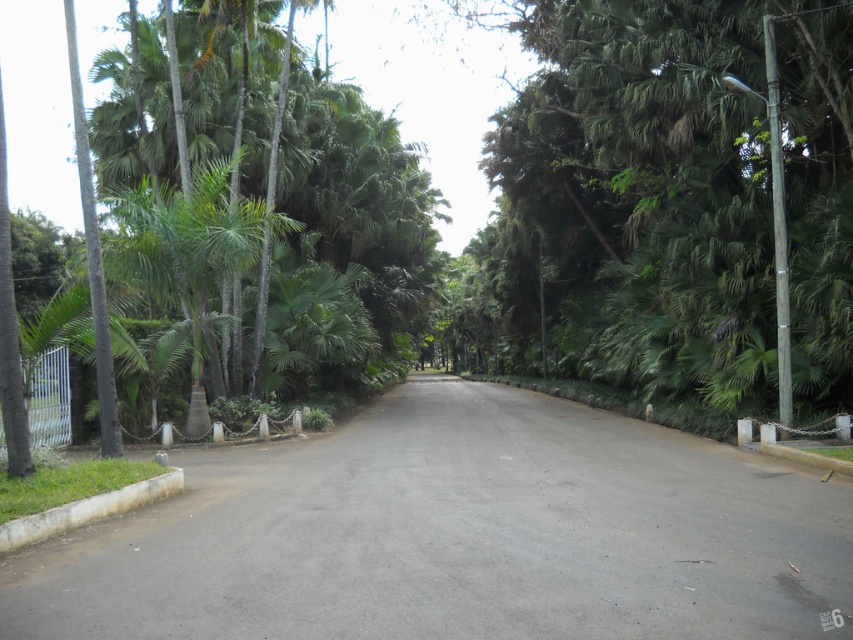
You are a landscape architect planning to install a new bench along the paved road. The bench requires a 10 meter clearance between any trees to ensure enough space. Based on the scene, will the distance between the green leafy tree at center and the green leafy palm at left allow for this bench installation?

The green leafy tree at center is 11.31 meters from the green leafy palm at left. Since the required clearance is 10 meters, the distance is sufficient, so the bench can be installed between them.

You are a gardener planning to plant a new tree in the grassy area next to the road. The green leafy tree at center and the green leafy palm at left are already present. Considering their widths, which tree would require more space to avoid overcrowding the area?

The green leafy palm at left requires more space because it has a greater width than the green leafy tree at center.

You are a pedestrian walking along the paved road and want to reach a green leafy palm at left. Which direction should you walk to get there from the green leafy tree at center?

The green leafy tree at center is positioned on the right side of the green leafy palm at left. To reach the green leafy palm at left from the green leafy tree at center, you should walk to the left.